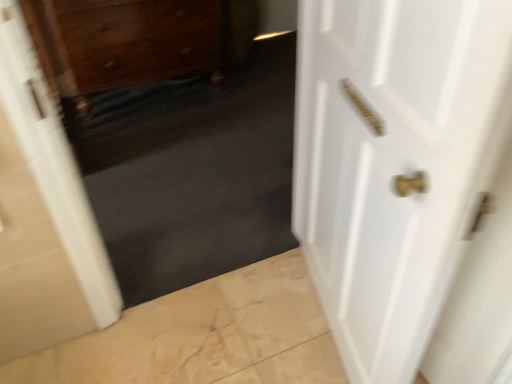
Identify the location of free space in front of wooden drawer at upper left. (155, 141).